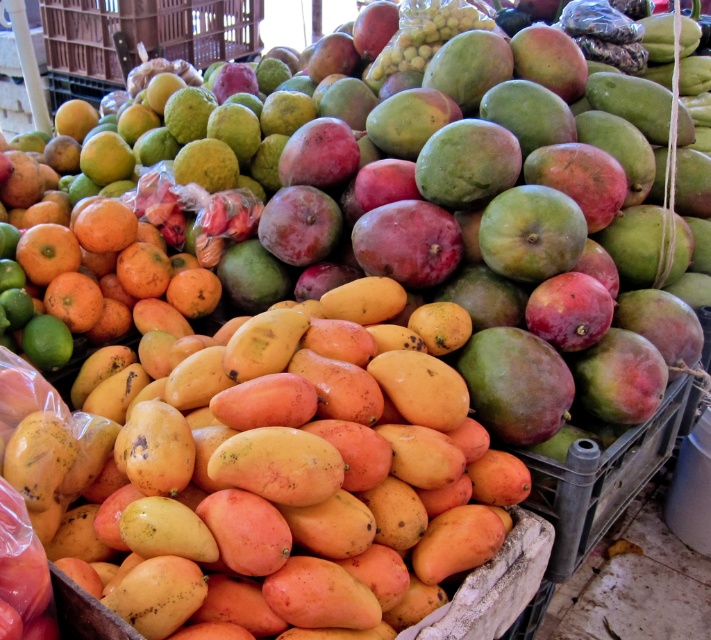
Question: Among these objects, which one is farthest from the camera?

Choices:
 (A) orange matte/orange at left
 (B) yellow matte mango at center

Answer: (A)

Question: Is yellow matte mango at center positioned before orange matte/orange at left?

Choices:
 (A) yes
 (B) no

Answer: (A)

Question: Which object appears closest to the camera in this image?

Choices:
 (A) yellow matte mango at center
 (B) orange matte/orange at left

Answer: (A)

Question: Does yellow matte mango at center have a larger size compared to orange matte/orange at left?

Choices:
 (A) no
 (B) yes

Answer: (B)

Question: In this image, where is yellow matte mango at center located relative to orange matte/orange at left?

Choices:
 (A) right
 (B) left

Answer: (A)